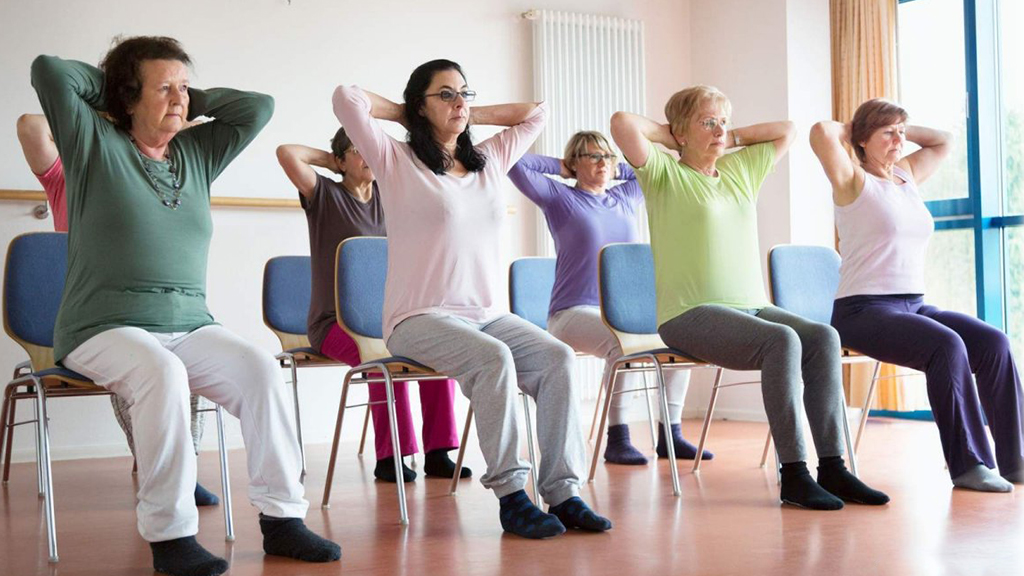
At what (x,y) coordinates should I click in order to perform the action: click on chairs. Please return your answer as a coordinate pair (x, y). This screenshot has height=576, width=1024. Looking at the image, I should click on (44, 282), (279, 291), (371, 291), (527, 276), (639, 284), (805, 283).